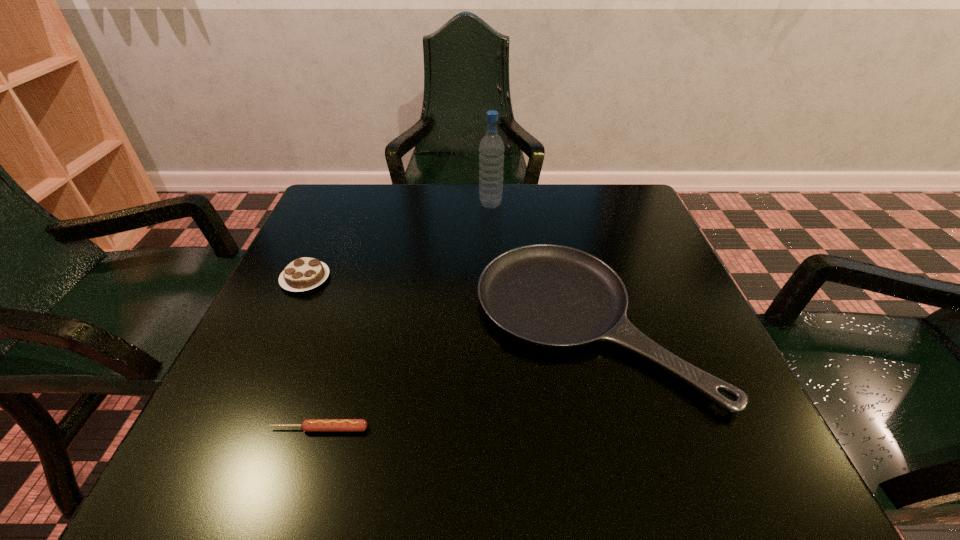
Locate an element on the screen. This screenshot has height=540, width=960. the farthest object is located at coordinates (491, 148).

Identify the location of the tallest object. (491, 148).

Locate an element on the screen. The height and width of the screenshot is (540, 960). chocolate cake is located at coordinates (303, 274).

The image size is (960, 540). In order to click on frying pan in this screenshot , I will do `click(549, 295)`.

Where is `the nearest object`? The height and width of the screenshot is (540, 960). the nearest object is located at coordinates (309, 425).

In order to click on sausage in this screenshot , I will do `click(309, 425)`.

I want to click on blank space located on the front of the farthest object, so click(x=492, y=250).

You are a GUI agent. You are given a task and a screenshot of the screen. Output one action in this format:
    pyautogui.click(x=<x>, y=<y>)
    Task: Click on the vacant space located 0.280m on the front of the chocolate cake
    This screenshot has width=960, height=540.
    Given the screenshot: What is the action you would take?
    pyautogui.click(x=240, y=423)

I want to click on vacant space situated on the back of the second shortest object, so click(x=564, y=221).

The width and height of the screenshot is (960, 540). I want to click on free spot located on the right of the nearest object, so click(415, 429).